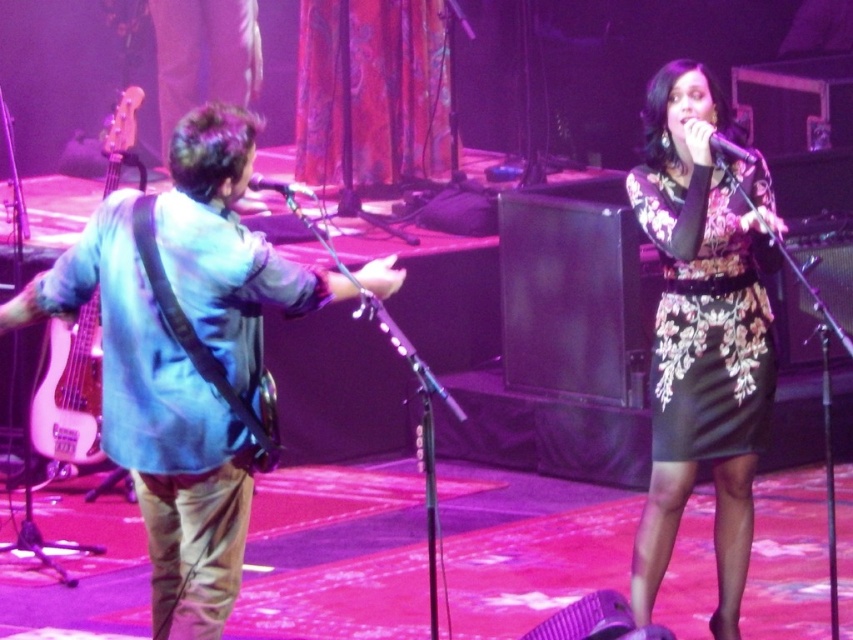
You are a stagehand preparing to adjust the lighting for the musician wearing the blue fabric shirt at left and the performer holding the metallic silver microphone at center. Which object takes up more horizontal space in the image?

The blue fabric shirt at left takes up more horizontal space than the metallic silver microphone at center because its width is larger.

You are a stagehand who needs to adjust the microphone stand. You are currently standing behind the black floral dress at center. Which direction should you move to reach the black glossy microphone at upper center?

Since the black glossy microphone at upper center is behind the black floral dress at center, you should move forward to reach it.